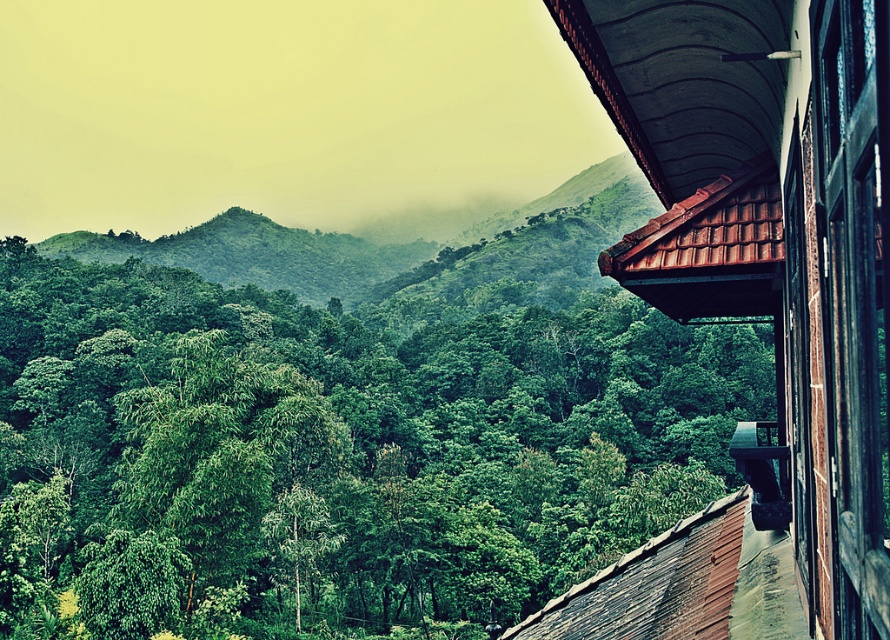
Question: Is green leafy trees at center thinner than black wood window at right?

Choices:
 (A) yes
 (B) no

Answer: (B)

Question: Does green leafy trees at center appear on the left side of black wood window at right?

Choices:
 (A) yes
 (B) no

Answer: (A)

Question: Which object is closer to the camera taking this photo?

Choices:
 (A) green leafy trees at center
 (B) black wood window at right

Answer: (B)

Question: Which of the following is the farthest from the observer?

Choices:
 (A) (860, 184)
 (B) (346, 484)

Answer: (B)

Question: Which object appears closest to the camera in this image?

Choices:
 (A) green leafy trees at center
 (B) black wood window at right

Answer: (B)

Question: Considering the relative positions of green leafy trees at center and black wood window at right in the image provided, where is green leafy trees at center located with respect to black wood window at right?

Choices:
 (A) above
 (B) below

Answer: (B)